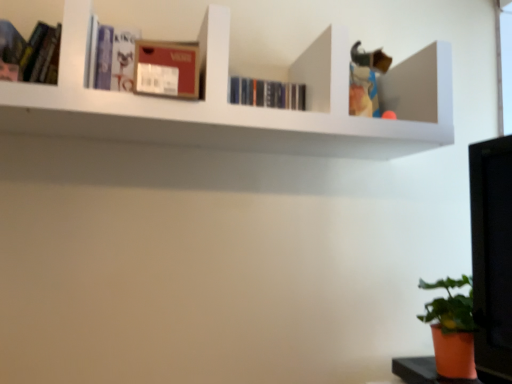
In order to face white matte shelf at upper center, should I rotate leftwards or rightwards?

Rotate left and turn 2.973 degrees.

What do you see at coordinates (452, 329) in the screenshot? I see `orange matte pot at lower right` at bounding box center [452, 329].

Locate an element on the screen. matte purple book at upper left, the first book viewed from the right is located at coordinates (111, 57).

How much space does matte black book at upper left, acting as the 1th book starting from the front, occupy horizontally?

matte black book at upper left, acting as the 1th book starting from the front, is 4.73 centimeters wide.

Find the location of a particular element. The width and height of the screenshot is (512, 384). white matte shelf at upper center is located at coordinates (243, 107).

Is matte purple book at upper left, the first book viewed from the right, oriented towards matte cardboard box at upper center?

No.

You are a GUI agent. You are given a task and a screenshot of the screen. Output one action in this format:
    pyautogui.click(x=<x>, y=<y>)
    Task: Click on the 2nd book above when counting from the matte cardboard box at upper center (from the image's perspective)
    
    Given the screenshot: What is the action you would take?
    pyautogui.click(x=111, y=57)

Can you tell me how much matte purple book at upper left, the first book viewed from the right, and matte cardboard box at upper center differ in facing direction?

5.9 degrees.

Which is farther, (119, 28) or (140, 91)?

Positioned behind is point (119, 28).

From a real-world perspective, who is located higher, matte cardboard box at upper center or orange matte pot at lower right?

matte cardboard box at upper center is physically above.

Looking at the image, does matte cardboard box at upper center seem bigger or smaller compared to orange matte pot at lower right?

matte cardboard box at upper center is smaller than orange matte pot at lower right.

Can you confirm if matte cardboard box at upper center is wider than orange matte pot at lower right?

Yes, matte cardboard box at upper center is wider than orange matte pot at lower right.

Is matte cardboard box at upper center facing towards orange matte pot at lower right?

No.

Does matte purple book at upper left, placed as the first book when sorted from back to front, touch white matte shelf at upper center?

matte purple book at upper left, placed as the first book when sorted from back to front, is not next to white matte shelf at upper center, and they're not touching.

Consider the image. Would you say matte purple book at upper left, the first book viewed from the right, is outside white matte shelf at upper center?

No, matte purple book at upper left, the first book viewed from the right, is not entirely external to white matte shelf at upper center.

Is matte purple book at upper left, placed as the first book when sorted from back to front, aimed at white matte shelf at upper center?

Yes.

Looking at their sizes, would you say matte purple book at upper left, the first book viewed from the right, is wider or thinner than white matte shelf at upper center?

In the image, matte purple book at upper left, the first book viewed from the right, appears to be more narrow than white matte shelf at upper center.

Considering the positions of objects matte purple book at upper left, the first book viewed from the right, and matte black book at upper left, arranged as the 2th book when viewed from the back, in the image provided, who is behind, matte purple book at upper left, the first book viewed from the right, or matte black book at upper left, arranged as the 2th book when viewed from the back,?

matte purple book at upper left, the first book viewed from the right.

Is matte purple book at upper left, the second book viewed from the left, facing towards matte black book at upper left, placed as the second book when sorted from right to left?

No, matte purple book at upper left, the second book viewed from the left, is not turned towards matte black book at upper left, placed as the second book when sorted from right to left.

Who is bigger, matte purple book at upper left, the first book viewed from the right, or matte black book at upper left, placed as the second book when sorted from right to left?

Bigger between the two is matte purple book at upper left, the first book viewed from the right.

Based on the photo, from a real-world perspective, is matte purple book at upper left, the 2th book viewed from the front, physically located above or below orange matte pot at lower right?

In terms of real-world spatial position, matte purple book at upper left, the 2th book viewed from the front, is above orange matte pot at lower right.

How distant is matte purple book at upper left, the first book viewed from the right, from orange matte pot at lower right?

They are 3.41 feet apart.

The height and width of the screenshot is (384, 512). I want to click on houseplant lying behind the matte purple book at upper left, the 2th book viewed from the front, so click(452, 329).

Is orange matte pot at lower right smaller than matte cardboard box at upper center?

Incorrect, orange matte pot at lower right is not smaller in size than matte cardboard box at upper center.

From a real-world perspective, which object rests below the other?

orange matte pot at lower right.

From the image's perspective, which one is positioned higher, orange matte pot at lower right or matte cardboard box at upper center?

matte cardboard box at upper center appears higher in the image.

Considering the relative sizes of orange matte pot at lower right and matte cardboard box at upper center in the image provided, is orange matte pot at lower right shorter than matte cardboard box at upper center?

No, orange matte pot at lower right is not shorter than matte cardboard box at upper center.

Is matte black book at upper left, which is the first book in left-to-right order, at the right side of orange matte pot at lower right?

Incorrect, matte black book at upper left, which is the first book in left-to-right order, is not on the right side of orange matte pot at lower right.

From the image's perspective, which is above, matte black book at upper left, which is the first book in left-to-right order, or orange matte pot at lower right?

matte black book at upper left, which is the first book in left-to-right order, is shown above in the image.

Which is in front, point (10, 75) or point (450, 375)?

Positioned in front is point (10, 75).

The image size is (512, 384). I want to click on book lying behind the matte cardboard box at upper center, so click(111, 57).

This screenshot has width=512, height=384. I want to click on houseplant that is on the right side of matte cardboard box at upper center, so click(452, 329).

Considering their positions, is white matte shelf at upper center positioned further to matte black book at upper left, arranged as the 2th book when viewed from the back, than matte cardboard box at upper center?

white matte shelf at upper center is positioned further to the anchor matte black book at upper left, arranged as the 2th book when viewed from the back.

Considering their positions, is white matte shelf at upper center positioned closer to matte purple book at upper left, the first book viewed from the right, than orange matte pot at lower right?

The object closer to matte purple book at upper left, the first book viewed from the right, is white matte shelf at upper center.

When comparing their distances from orange matte pot at lower right, does white matte shelf at upper center or matte black book at upper left, placed as the second book when sorted from right to left, seem further?

Among the two, matte black book at upper left, placed as the second book when sorted from right to left, is located further to orange matte pot at lower right.

Based on the photo, estimate the real-world distances between objects in this image. Which object is closer to matte purple book at upper left, the 2th book viewed from the front, matte black book at upper left, acting as the 1th book starting from the front, or matte cardboard box at upper center?

matte cardboard box at upper center.

From the image, which object appears to be farther from orange matte pot at lower right, matte purple book at upper left, the 2th book viewed from the front, or white matte shelf at upper center?

matte purple book at upper left, the 2th book viewed from the front, is further to orange matte pot at lower right.

Looking at the image, which one is located further to matte black book at upper left, arranged as the 2th book when viewed from the back, matte purple book at upper left, the first book viewed from the right, or orange matte pot at lower right?

Among the two, orange matte pot at lower right is located further to matte black book at upper left, arranged as the 2th book when viewed from the back.

Considering their positions, is orange matte pot at lower right positioned closer to white matte shelf at upper center than matte black book at upper left, placed as the second book when sorted from right to left?

matte black book at upper left, placed as the second book when sorted from right to left.

Based on their spatial positions, is matte black book at upper left, which is the first book in left-to-right order, or matte purple book at upper left, placed as the first book when sorted from back to front, closer to orange matte pot at lower right?

Based on the image, matte purple book at upper left, placed as the first book when sorted from back to front, appears to be nearer to orange matte pot at lower right.

Image resolution: width=512 pixels, height=384 pixels. I want to click on book between matte black book at upper left, placed as the second book when sorted from right to left, and white matte shelf at upper center, in the horizontal direction, so click(x=111, y=57).

This screenshot has width=512, height=384. I want to click on book between matte black book at upper left, which is the first book in left-to-right order, and matte cardboard box at upper center, in the horizontal direction, so click(x=111, y=57).

The height and width of the screenshot is (384, 512). I want to click on paperback book located between matte purple book at upper left, the second book viewed from the left, and white matte shelf at upper center in the left-right direction, so click(167, 69).

Find the location of a particular element. The width and height of the screenshot is (512, 384). shelf between matte black book at upper left, placed as the second book when sorted from right to left, and orange matte pot at lower right, in the horizontal direction is located at coordinates (243, 107).